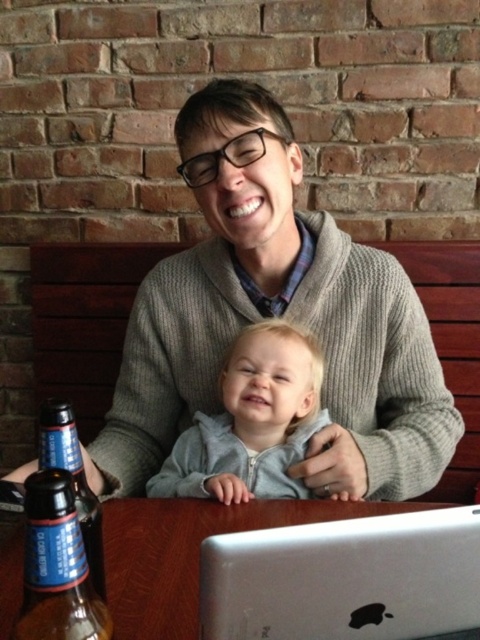
Between point (460, 513) and point (235, 490), which one is positioned in front?

Point (460, 513)

Does point (419, 550) come closer to viewer compared to point (277, 452)?

Yes, it is.

The width and height of the screenshot is (480, 640). Identify the location of silver metallic laptop at center. (345, 579).

Does silver metallic laptop at center have a lesser height compared to clear glass bottle at lower left?

Yes, silver metallic laptop at center is shorter than clear glass bottle at lower left.

Which of these two, silver metallic laptop at center or clear glass bottle at lower left, stands shorter?

silver metallic laptop at center is shorter.

You are a GUI agent. You are given a task and a screenshot of the screen. Output one action in this format:
    pyautogui.click(x=<x>, y=<y>)
    Task: Click on the silver metallic laptop at center
    Image resolution: width=480 pixels, height=640 pixels.
    Given the screenshot: What is the action you would take?
    pyautogui.click(x=345, y=579)

Image resolution: width=480 pixels, height=640 pixels. What are the coordinates of `silver metallic laptop at center` in the screenshot? It's located at (345, 579).

Measure the distance from gray knitted sweater at center to brown glass bottle at lower left.

gray knitted sweater at center and brown glass bottle at lower left are 19.80 inches apart from each other.

Is gray knitted sweater at center positioned in front of brown glass bottle at lower left?

No.

Is point (239, 81) closer to viewer compared to point (45, 451)?

That is False.

Where is `gray knitted sweater at center`? The width and height of the screenshot is (480, 640). gray knitted sweater at center is located at coordinates [276, 316].